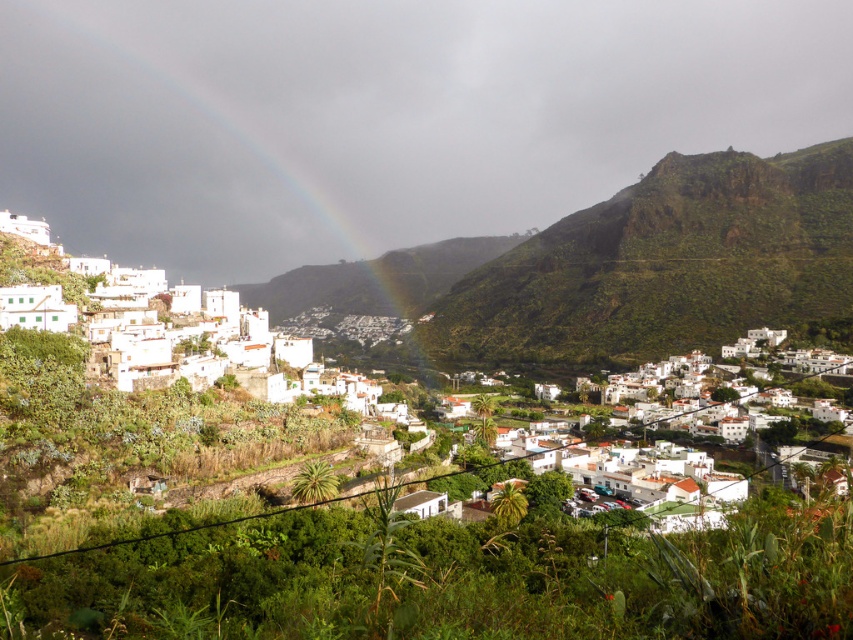
You are a tourist standing in the valley and want to take a photo of both the rainbow at left and the white matte houses at center. Based on their positions, which object should you frame first in your camera to ensure both are visible?

The rainbow at left is positioned on the left side of white matte houses at center, so you should frame the white matte houses at center first and then adjust to include the rainbow at left on the left side.

You are standing at the point closest to the bottom of the image and want to take a photo of the town nestled in the valley. Which of the two points, point (x=578, y=157) or point (x=18, y=422), should you stand at to ensure the town is fully visible in your photo?

You should stand at point (x=18, y=422) because it is closer to the bottom of the image, providing a better vantage point to see the town nestled in the valley.